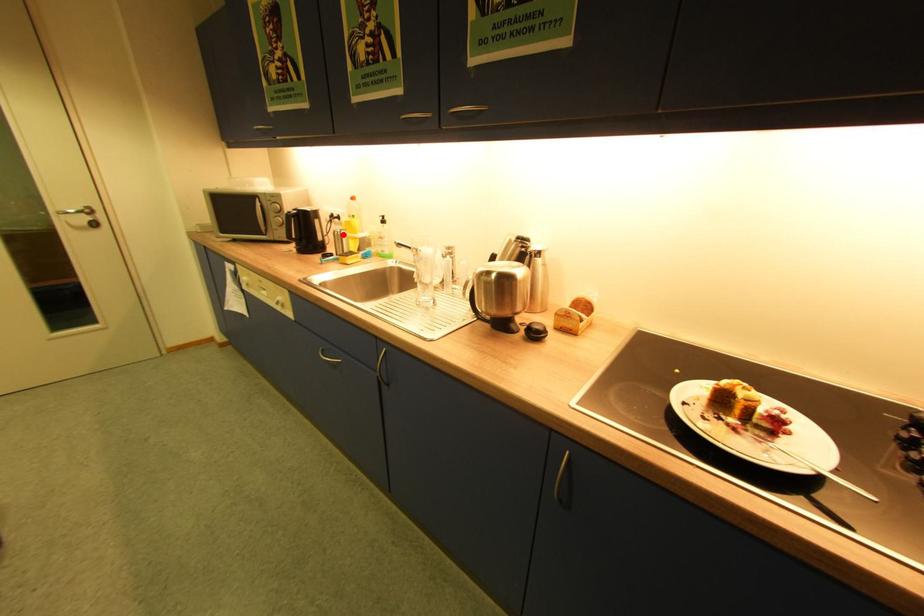
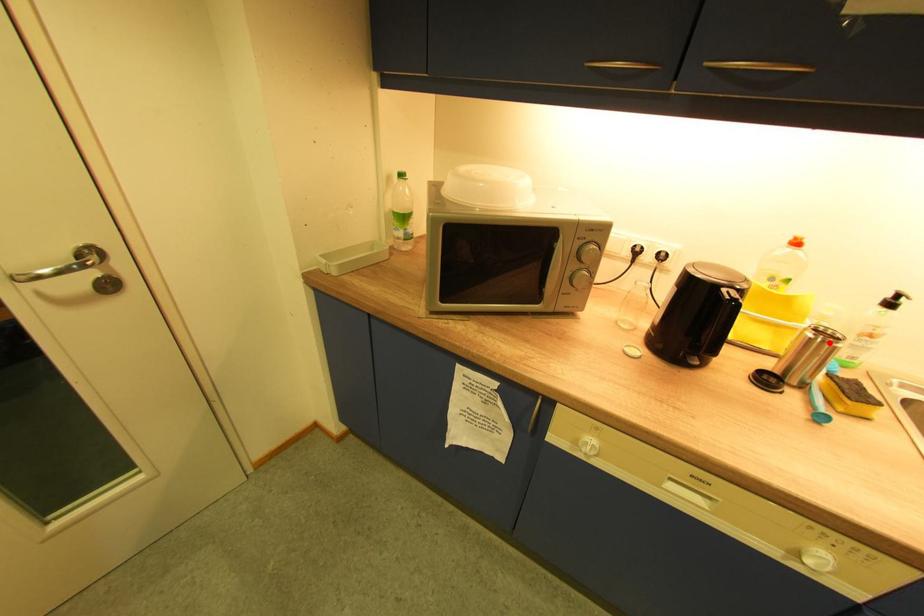
I am providing you with two images of the same scene from different viewpoints. A red point is marked on the first image and another point is marked on the second image. Do the highlighted points in image1 and image2 indicate the same real-world spot?

Yes